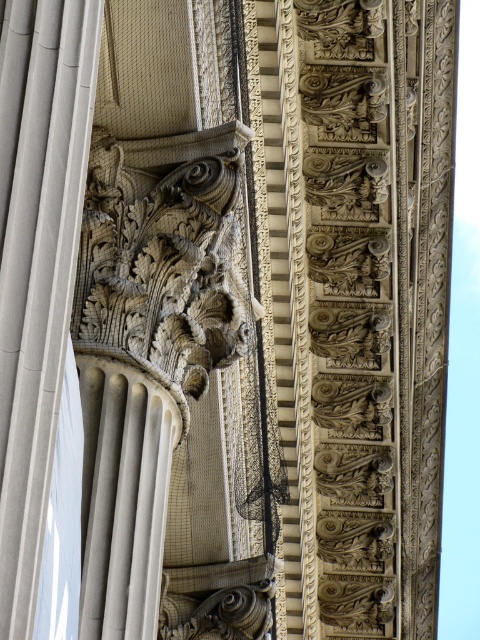
Who is positioned more to the left, carved stone column at center or smooth stone column at center?

From the viewer's perspective, carved stone column at center appears more on the left side.

Between point (40, 128) and point (132, 552), which one is positioned behind?

The point (132, 552) is more distant.

Locate an element on the screen. carved stone column at center is located at coordinates (36, 262).